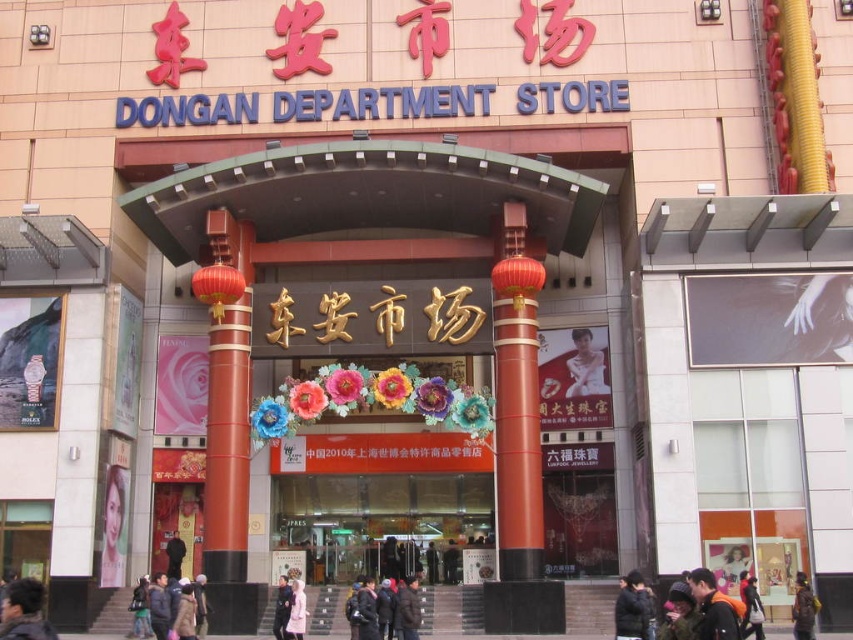
Between light pink fabric coat at center and dark blue jacket at center, which one has less height?

dark blue jacket at center is shorter.

Does light pink fabric coat at center have a greater height compared to dark blue jacket at center?

Yes, light pink fabric coat at center is taller than dark blue jacket at center.

Which is behind, point (296, 589) or point (277, 614)?

The point (296, 589) is more distant.

Locate an element on the screen. light pink fabric coat at center is located at coordinates (296, 611).

Can you confirm if dark brown leather jacket at lower right is wider than light pink fabric coat at center?

Incorrect, dark brown leather jacket at lower right's width does not surpass light pink fabric coat at center's.

Between point (799, 634) and point (305, 618), which one is positioned in front?

Point (799, 634)

You are a GUI agent. You are given a task and a screenshot of the screen. Output one action in this format:
    pyautogui.click(x=<x>, y=<y>)
    Task: Click on the dark brown leather jacket at lower right
    
    Given the screenshot: What is the action you would take?
    pyautogui.click(x=804, y=609)

Can you confirm if dark gray jacket at lower center is positioned to the left of dark gray puffer jacket at lower center?

Correct, you'll find dark gray jacket at lower center to the left of dark gray puffer jacket at lower center.

What do you see at coordinates (172, 609) in the screenshot? I see `dark gray jacket at lower center` at bounding box center [172, 609].

Where is `dark gray jacket at lower center`? dark gray jacket at lower center is located at coordinates (172, 609).